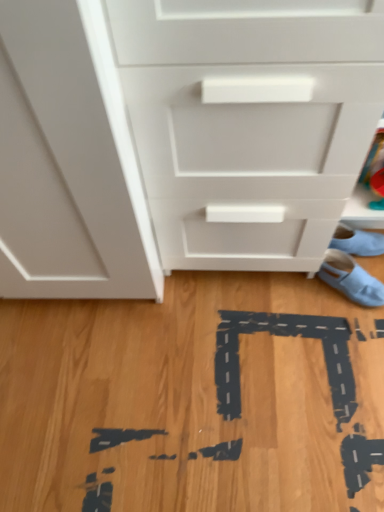
At what (x,y) coordinates should I click in order to perform the action: click on free space to the left of light blue fabric shoe at lower right, which is counted as the 1th footwear, starting from the bottom. Please return your answer as a coordinate pair (x, y). The image size is (384, 512). Looking at the image, I should click on (288, 308).